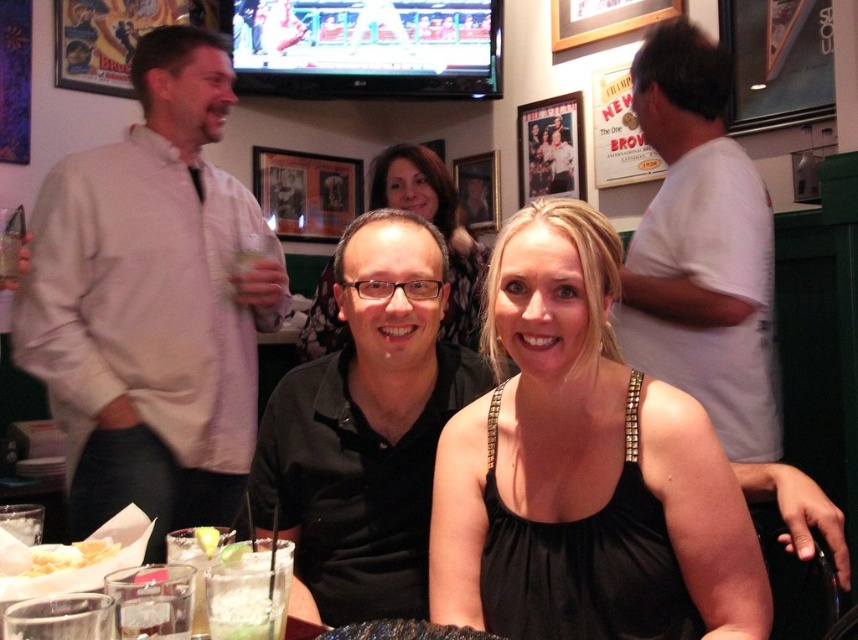
In the scene shown: Does white shirt at left appear on the left side of black matte shirt at center?

Indeed, white shirt at left is positioned on the left side of black matte shirt at center.

Who is more distant from viewer, (142, 483) or (309, 388)?

Positioned behind is point (142, 483).

Locate an element on the screen. This screenshot has height=640, width=858. white shirt at left is located at coordinates (152, 301).

Does black matte shirt at center have a greater height compared to white cotton t-shirt at right?

Incorrect, black matte shirt at center's height is not larger of white cotton t-shirt at right's.

Who is positioned more to the left, black matte shirt at center or white cotton t-shirt at right?

Positioned to the left is black matte shirt at center.

Is point (445, 280) closer to camera compared to point (744, 209)?

That is True.

Identify the location of black matte shirt at center. (367, 428).

Can you confirm if black satin dress at center is thinner than matte black dress at center?

No.

In the scene shown: Between black satin dress at center and matte black dress at center, which one appears on the left side from the viewer's perspective?

From the viewer's perspective, matte black dress at center appears more on the left side.

Who is more forward, (573, 403) or (322, 289)?

Point (573, 403)

Identify the location of black satin dress at center. The image size is (858, 640). (583, 468).